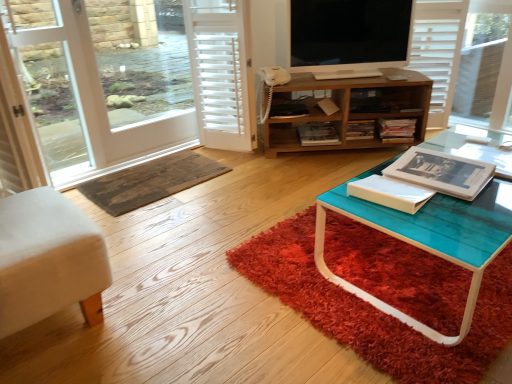
Question: Which is correct: black glossy tv at upper center is inside shaggy red rug at lower center, marked as the first doormat in a front-to-back arrangement, or outside of it?

Choices:
 (A) inside
 (B) outside

Answer: (B)

Question: From a real-world perspective, is black glossy tv at upper center positioned above or below shaggy red rug at lower center, the first doormat positioned from the right?

Choices:
 (A) above
 (B) below

Answer: (A)

Question: Estimate the real-world distances between objects in this image. Which object is closer to the wooden textured doormat at center, the second doormat when ordered from right to left?

Choices:
 (A) wooden cabinet at center
 (B) black glossy tv at upper center
 (C) white fabric cushion at lower left
 (D) transparent glass screen door at left
 (E) shaggy red rug at lower center, marked as the first doormat in a front-to-back arrangement

Answer: (D)

Question: Based on their relative distances, which object is farther from the white fabric cushion at lower left?

Choices:
 (A) black glossy tv at upper center
 (B) wooden textured doormat at center, which is the second doormat in front-to-back order
 (C) wooden cabinet at center
 (D) transparent glass screen door at left
 (E) shaggy red rug at lower center, the first doormat positioned from the right

Answer: (A)